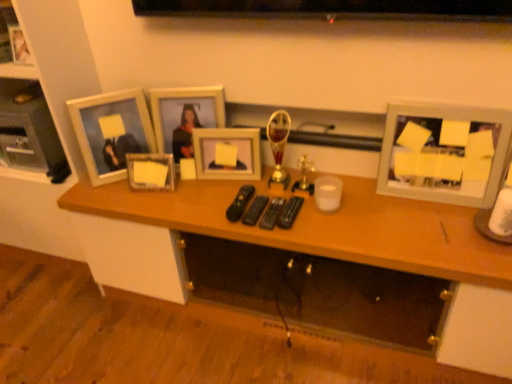
Question: Should I look upward or downward to see white matte picture frame at upper left, the second picture frame viewed from the left?

Choices:
 (A) up
 (B) down

Answer: (A)

Question: Does black plastic remote control at center, which is the third remote control in right-to-left order, lie behind black plastic remote control at center, which is the third remote control from left to right?

Choices:
 (A) no
 (B) yes

Answer: (B)

Question: From the image's perspective, is black plastic remote control at center, which appears as the 2th remote control when viewed from the left, located above black plastic remote control at center, the 2th remote control when ordered from right to left?

Choices:
 (A) yes
 (B) no

Answer: (A)

Question: From the image's perspective, is black plastic remote control at center, which appears as the 2th remote control when viewed from the left, below black plastic remote control at center, which is the third remote control from left to right?

Choices:
 (A) no
 (B) yes

Answer: (A)

Question: Is black plastic remote control at center, which is the third remote control in right-to-left order, positioned in front of black plastic remote control at center, the 2th remote control when ordered from right to left?

Choices:
 (A) yes
 (B) no

Answer: (B)

Question: Is black plastic remote control at center, which appears as the 2th remote control when viewed from the left, at the right side of black plastic remote control at center, the 2th remote control when ordered from right to left?

Choices:
 (A) no
 (B) yes

Answer: (A)

Question: Is black plastic remote control at center, which is the third remote control in right-to-left order, not near black plastic remote control at center, the 2th remote control when ordered from right to left?

Choices:
 (A) yes
 (B) no

Answer: (B)

Question: From the image's perspective, is wooden photo frame at center, the 3th picture frame in the right-to-left sequence, located beneath matte glass picture frame at center, positioned as the second picture frame in right-to-left order?

Choices:
 (A) no
 (B) yes

Answer: (A)

Question: Can you confirm if wooden photo frame at center, the 3th picture frame in the right-to-left sequence, is shorter than matte glass picture frame at center, which appears as the fifth picture frame when viewed from the left?

Choices:
 (A) yes
 (B) no

Answer: (B)

Question: Is wooden photo frame at center, which is counted as the 4th picture frame, starting from the left, aimed at matte glass picture frame at center, which appears as the fifth picture frame when viewed from the left?

Choices:
 (A) no
 (B) yes

Answer: (B)

Question: Is matte glass picture frame at center, which appears as the fifth picture frame when viewed from the left, a part of wooden photo frame at center, which is counted as the 4th picture frame, starting from the left?

Choices:
 (A) no
 (B) yes

Answer: (A)

Question: From a real-world perspective, is wooden photo frame at center, which is counted as the 4th picture frame, starting from the left, physically below matte glass picture frame at center, positioned as the second picture frame in right-to-left order?

Choices:
 (A) yes
 (B) no

Answer: (B)

Question: Is wooden photo frame at center, the 3th picture frame in the right-to-left sequence, oriented away from matte glass picture frame at center, which appears as the fifth picture frame when viewed from the left?

Choices:
 (A) no
 (B) yes

Answer: (A)

Question: Is black plastic remote at center, arranged as the fourth remote control when viewed from the right, completely or partially outside of wooden picture frame at center, the 4th picture frame in the right-to-left sequence?

Choices:
 (A) yes
 (B) no

Answer: (A)